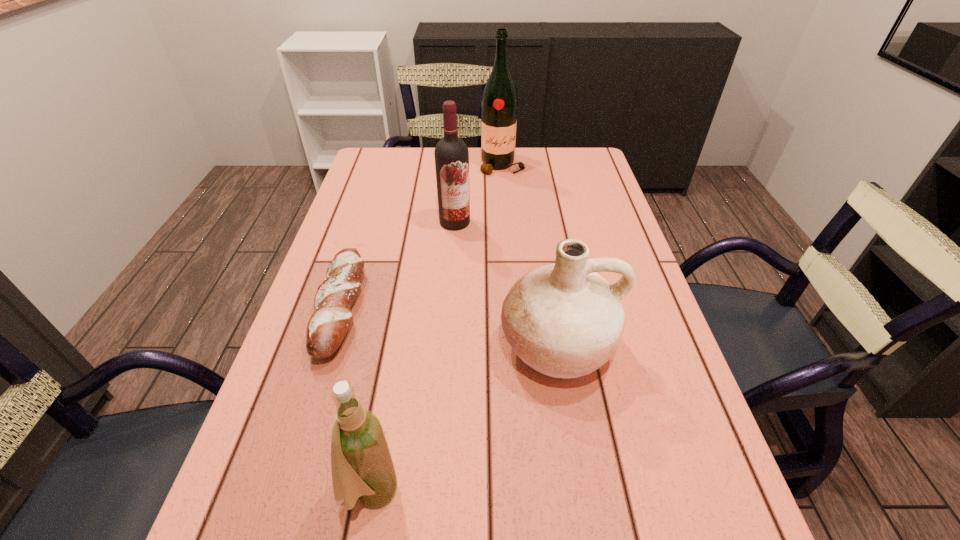
In the image, there is a desktop. Identify the location of free space at the far right corner. (589, 159).

Locate an element on the screen. The width and height of the screenshot is (960, 540). free point between the second farthest wine bottle and the farthest object is located at coordinates (478, 194).

Where is `empty location between the pottery and the second nearest wine bottle`? The image size is (960, 540). empty location between the pottery and the second nearest wine bottle is located at coordinates (506, 284).

Find the location of a particular element. empty space between the farthest object and the pottery is located at coordinates (529, 256).

You are a GUI agent. You are given a task and a screenshot of the screen. Output one action in this format:
    pyautogui.click(x=<x>, y=<y>)
    Task: Click on the unoccupied position between the fourth nearest object and the rightmost wine bottle
    
    Given the screenshot: What is the action you would take?
    pyautogui.click(x=478, y=194)

Where is `free space that is in between the rightmost wine bottle and the nearest object`? free space that is in between the rightmost wine bottle and the nearest object is located at coordinates (436, 328).

Image resolution: width=960 pixels, height=540 pixels. Find the location of `unoccupied position between the pottery and the fourth object from right to left`. unoccupied position between the pottery and the fourth object from right to left is located at coordinates (464, 418).

Locate an element on the screen. Image resolution: width=960 pixels, height=540 pixels. vacant area that lies between the pottery and the baguet is located at coordinates point(448,327).

This screenshot has height=540, width=960. Find the location of `empty space between the farthest object and the nearest wine bottle`. empty space between the farthest object and the nearest wine bottle is located at coordinates (436, 328).

Locate which object ranks fourth in proximity to the pottery. Please provide its 2D coordinates. Your answer should be formatted as a tuple, i.e. [(x, y)], where the tuple contains the x and y coordinates of a point satisfying the conditions above.

[(499, 101)]